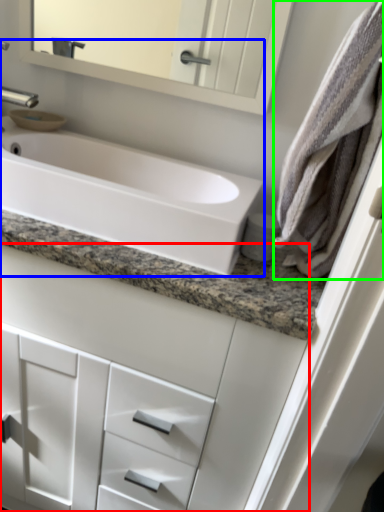
Question: Based on their relative distances, which object is nearer to bathroom cabinet (highlighted by a red box)? Choose from sink (highlighted by a blue box) and bath towel (highlighted by a green box).

Choices:
 (A) sink
 (B) bath towel

Answer: (A)